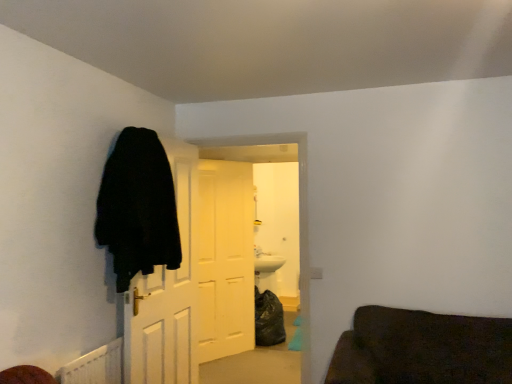
Question: From a real-world perspective, is black fuzzy coat at left above or below white wooden door at center, which is counted as the second door, starting from the front?

Choices:
 (A) below
 (B) above

Answer: (B)

Question: From the image's perspective, relative to white wooden door at center, which is counted as the second door, starting from the front, is black fuzzy coat at left above or below?

Choices:
 (A) below
 (B) above

Answer: (B)

Question: Which is nearer to the black fuzzy coat at left?

Choices:
 (A) black matte door at left, the 1th door in the front-to-back sequence
 (B) white matte door at center, marked as the 3th door in a front-to-back arrangement
 (C) white wooden door at center, which is the second door from back to front

Answer: (A)

Question: Estimate the real-world distances between objects in this image. Which object is closer to the white matte door at center, acting as the 1th door starting from the back?

Choices:
 (A) white wooden door at center, which is the second door from back to front
 (B) black fuzzy coat at left
 (C) black matte door at left, the 1th door in the front-to-back sequence

Answer: (A)